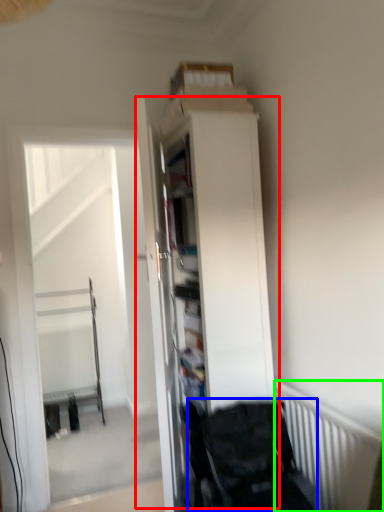
Question: Which is nearer to the dresser (highlighted by a red box)? baby carriage (highlighted by a blue box) or radiator (highlighted by a green box).

Choices:
 (A) baby carriage
 (B) radiator

Answer: (A)